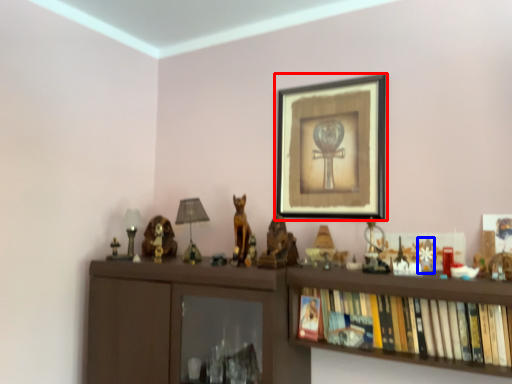
Question: Which of the following is the farthest to the observer, picture frame (highlighted by a red box) or toy (highlighted by a blue box)?

Choices:
 (A) picture frame
 (B) toy

Answer: (A)